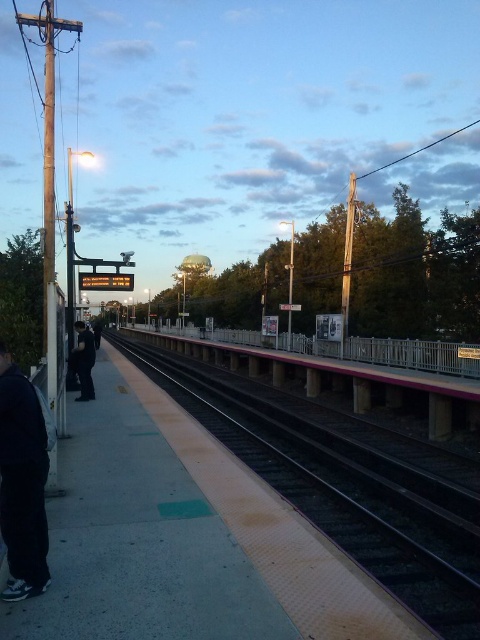
You are standing on the train station platform and notice two people wearing black matte pants at lower left and dark blue jeans at left. Which person is closer to the edge of the platform?

The black matte pants at lower left is located below dark blue jeans at left, so the person wearing black matte pants at lower left is closer to the edge of the platform.

You are standing on the platform and see the smooth concrete track at center and the dark blue jeans at left. Which object is closer to you?

The smooth concrete track at center is closer to you because it is in front of the dark blue jeans at left.

You are a passenger on the platform and want to board the train. You notice the black matte pants at lower left and the smooth concrete track at center. Which object is closer to you as you stand on the platform?

The smooth concrete track at center is closer to you because the black matte pants at lower left is behind it.